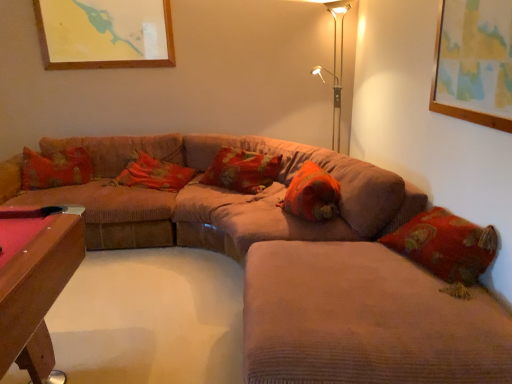
Question: Looking at the image, does velvet beige couch at center, the first couch in the front-to-back sequence, seem bigger or smaller compared to velvet floral pillow at center, the third pillow positioned from the right?

Choices:
 (A) small
 (B) big

Answer: (B)

Question: From a real-world perspective, relative to velvet floral pillow at center, which is the 1th pillow from left to right, is velvet beige couch at center, the second couch in the back-to-front sequence, vertically above or below?

Choices:
 (A) below
 (B) above

Answer: (A)

Question: Which is farther from the velvet beige couch at center, the first couch in the front-to-back sequence?

Choices:
 (A) velvet floral pillow at center, which is the 1th pillow from left to right
 (B) floral fabric pillow at center, marked as the second pillow in a right-to-left arrangement
 (C) corduroy couch at center, which ranks as the 2th couch in front-to-back order
 (D) metallic gold table lamp at upper right
 (E) orange fabric pillow at center, which ranks as the 3th pillow in left-to-right order

Answer: (D)

Question: Considering the real-world distances, which object is farthest from the velvet floral pillow at center, the third pillow positioned from the right?

Choices:
 (A) velvet beige couch at center, the first couch in the front-to-back sequence
 (B) metallic gold table lamp at upper right
 (C) corduroy couch at center, which ranks as the 2th couch in front-to-back order
 (D) floral fabric pillow at center, marked as the second pillow in a right-to-left arrangement
 (E) orange fabric pillow at center, marked as the 1th pillow in a right-to-left arrangement

Answer: (A)